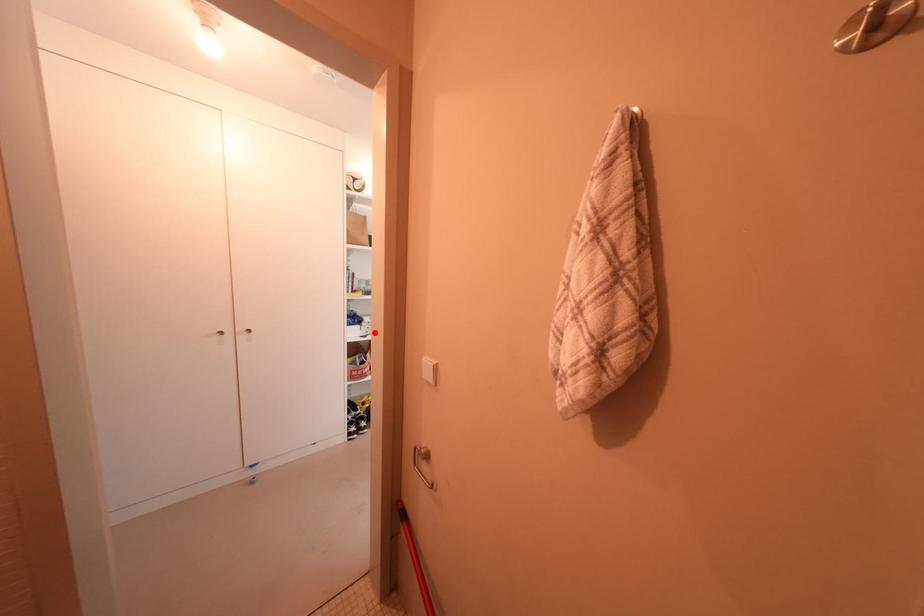
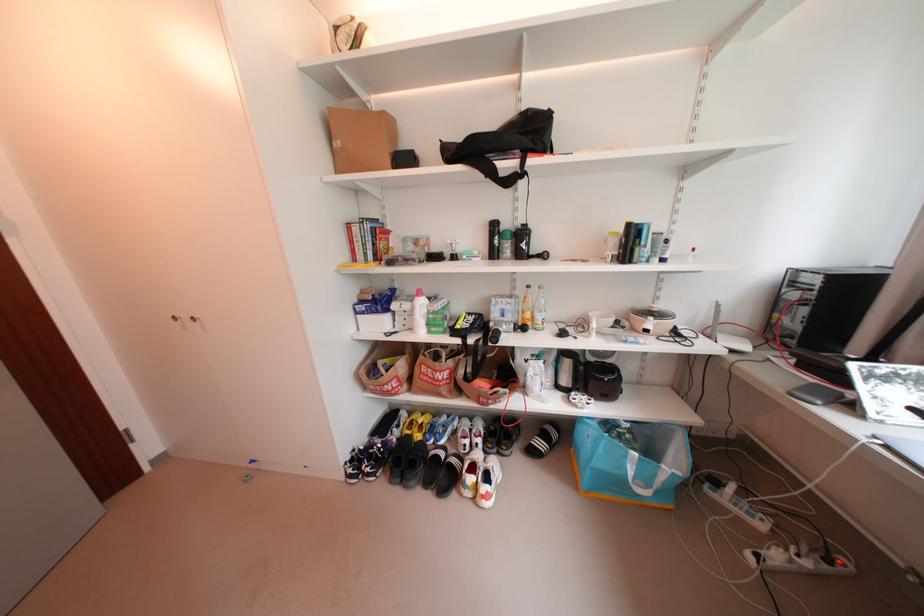
Find the pixel in the second image that matches the highlighted location in the first image.

(412, 326)